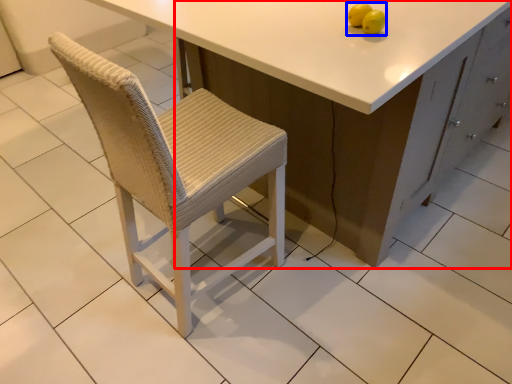
Question: Which object is further to the camera taking this photo, cabinetry (highlighted by a red box) or fruit (highlighted by a blue box)?

Choices:
 (A) cabinetry
 (B) fruit

Answer: (B)